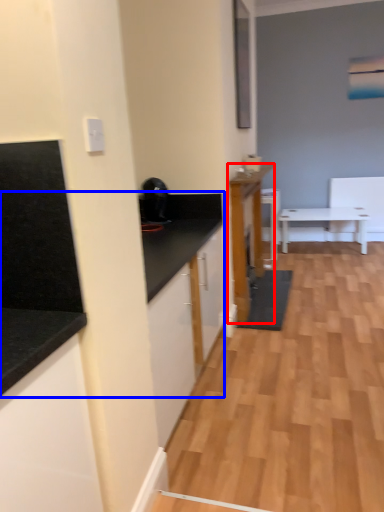
Question: Which point is closer to the camera, cabinetry (highlighted by a red box) or countertop (highlighted by a blue box)?

Choices:
 (A) cabinetry
 (B) countertop

Answer: (B)